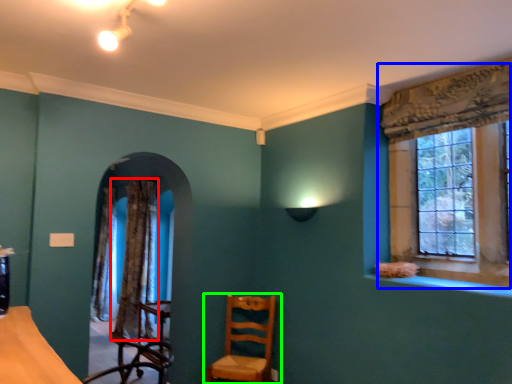
Question: Which is farther away from curtain (highlighted by a red box)? window (highlighted by a blue box) or chair (highlighted by a green box)?

Choices:
 (A) window
 (B) chair

Answer: (A)